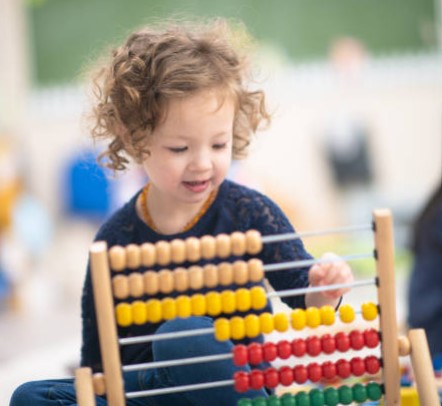
I want to click on abacus bead in third row down, so click(120, 312), click(138, 310), click(150, 310), click(169, 309), click(180, 309), click(198, 309), click(211, 305), click(231, 302), click(243, 301), click(259, 298).